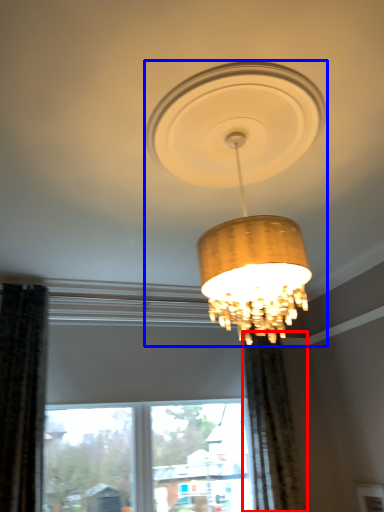
Question: Which point is further to the camera, curtain (highlighted by a red box) or lamp (highlighted by a blue box)?

Choices:
 (A) curtain
 (B) lamp

Answer: (A)